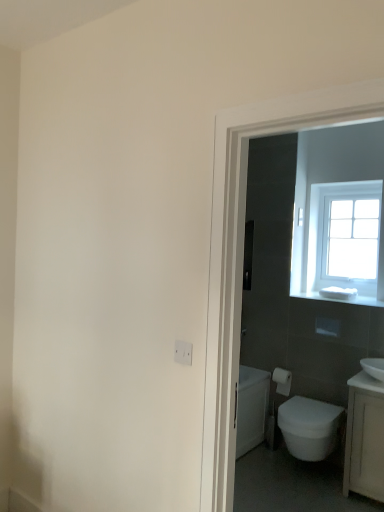
This screenshot has width=384, height=512. What do you see at coordinates (369, 375) in the screenshot?
I see `white glossy sink at right` at bounding box center [369, 375].

Describe the element at coordinates (282, 381) in the screenshot. The width and height of the screenshot is (384, 512). I see `white matte toilet paper at right` at that location.

Describe the element at coordinates (364, 437) in the screenshot. I see `white glossy sink at right` at that location.

Image resolution: width=384 pixels, height=512 pixels. In order to click on clear glass window at upper right in this screenshot , I will do `click(344, 237)`.

Where is `white plastic electric outlet at lower center`? The width and height of the screenshot is (384, 512). white plastic electric outlet at lower center is located at coordinates (183, 352).

Considering the relative positions of clear glass window at upper right and white glossy sink at right in the image provided, is clear glass window at upper right to the left or to the right of white glossy sink at right?

clear glass window at upper right is positioned on white glossy sink at right's right side.

Is the depth of clear glass window at upper right greater than that of white glossy sink at right?

Yes, clear glass window at upper right is further from the viewer.

From the image's perspective, does clear glass window at upper right appear lower than white glossy sink at right?

No, from the image's perspective, clear glass window at upper right is not below white glossy sink at right.

Between clear glass window at upper right and white glossy sink at right, which one has less height?

With less height is white glossy sink at right.

What's the angular difference between clear glass window at upper right and white glossy bidet at lower right's facing directions?

1.88 degrees separate the facing orientations of clear glass window at upper right and white glossy bidet at lower right.

From a real-world perspective, which is physically below, clear glass window at upper right or white glossy bidet at lower right?

From a 3D spatial view, white glossy bidet at lower right is below.

Does clear glass window at upper right have a greater height compared to white glossy bidet at lower right?

Yes, clear glass window at upper right is taller than white glossy bidet at lower right.

Considering the sizes of clear glass window at upper right and white glossy bidet at lower right in the image, is clear glass window at upper right wider or thinner than white glossy bidet at lower right?

clear glass window at upper right is thinner than white glossy bidet at lower right.

From a real-world perspective, which is physically above, white glossy sink at right or white glossy sink at right?

white glossy sink at right.

Does white glossy sink at right appear on the left side of white glossy sink at right?

No, white glossy sink at right is not to the left of white glossy sink at right.

Does white glossy sink at right have a smaller size compared to white glossy sink at right?

Yes.

Considering the points (374, 378) and (349, 412), which point is behind, point (374, 378) or point (349, 412)?

The point (349, 412) is behind.

Consider the image. From their relative heights in the image, would you say white plastic electric outlet at lower center is taller or shorter than clear glass window at upper right?

Clearly, white plastic electric outlet at lower center is shorter compared to clear glass window at upper right.

From the picture: Between white plastic electric outlet at lower center and clear glass window at upper right, which one appears on the right side from the viewer's perspective?

From the viewer's perspective, clear glass window at upper right appears more on the right side.

From a real-world perspective, does white plastic electric outlet at lower center sit lower than white matte toilet paper at right?

No, from a real-world perspective, white plastic electric outlet at lower center is not below white matte toilet paper at right.

Does point (180, 358) appear closer or farther from the camera than point (281, 379)?

Point (180, 358) is positioned closer to the camera compared to point (281, 379).

Is white plastic electric outlet at lower center far from white matte toilet paper at right?

white plastic electric outlet at lower center is positioned a significant distance from white matte toilet paper at right.

How many degrees apart are the facing directions of white glossy bidet at lower right and white glossy sink at right?

1.68 degrees.

Is white glossy bidet at lower right closer to the viewer compared to white glossy sink at right?

No, it is behind white glossy sink at right.

From a real-world perspective, is white glossy bidet at lower right positioned over white glossy sink at right based on gravity?

Incorrect, from a real-world perspective, white glossy bidet at lower right is lower than white glossy sink at right.

Is white glossy bidet at lower right looking in the opposite direction of white glossy sink at right?

That's not correct — white glossy bidet at lower right is not looking away from white glossy sink at right.

In terms of height, does white matte toilet paper at right look taller or shorter compared to white glossy sink at right?

Clearly, white matte toilet paper at right is shorter compared to white glossy sink at right.

Considering the sizes of objects white matte toilet paper at right and white glossy sink at right in the image provided, who is thinner, white matte toilet paper at right or white glossy sink at right?

With smaller width is white matte toilet paper at right.

Is the depth of white matte toilet paper at right greater than that of white glossy sink at right?

Yes, white matte toilet paper at right is behind white glossy sink at right.

Locate an element on the screen. The image size is (384, 512). window above the white glossy sink at right (from the image's perspective) is located at coordinates (344, 237).

Identify the location of window that appears behind the white glossy bidet at lower right. The width and height of the screenshot is (384, 512). (344, 237).

Looking at the image, which one is located further to white glossy bidet at lower right, white matte toilet paper at right or white glossy sink at right?

Among the two, white matte toilet paper at right is located further to white glossy bidet at lower right.

Estimate the real-world distances between objects in this image. Which object is closer to white glossy bidet at lower right, white glossy sink at right or clear glass window at upper right?

Based on the image, white glossy sink at right appears to be nearer to white glossy bidet at lower right.

When comparing their distances from white glossy sink at right, does white glossy bidet at lower right or clear glass window at upper right seem closer?

white glossy bidet at lower right.

In the scene shown: Based on their spatial positions, is white plastic electric outlet at lower center or clear glass window at upper right further from white glossy sink at right?

white plastic electric outlet at lower center is positioned further to the anchor white glossy sink at right.

From the image, which object appears to be nearer to white matte toilet paper at right, white glossy bidet at lower right or white glossy sink at right?

Based on the image, white glossy bidet at lower right appears to be nearer to white matte toilet paper at right.

From the picture: From the image, which object appears to be nearer to white plastic electric outlet at lower center, white glossy bidet at lower right or white glossy sink at right?

white glossy sink at right is positioned closer to the anchor white plastic electric outlet at lower center.

Which object lies further to the anchor point clear glass window at upper right, white matte toilet paper at right or white glossy sink at right?

white matte toilet paper at right.

Looking at the image, which one is located further to white glossy sink at right, white plastic electric outlet at lower center or white matte toilet paper at right?

Among the two, white plastic electric outlet at lower center is located further to white glossy sink at right.

At what (x,y) coordinates should I click in order to perform the action: click on toilet paper that lies between clear glass window at upper right and white glossy bidet at lower right from top to bottom. Please return your answer as a coordinate pair (x, y). Image resolution: width=384 pixels, height=512 pixels. Looking at the image, I should click on (282, 381).

At what (x,y) coordinates should I click in order to perform the action: click on sink between clear glass window at upper right and white glossy sink at right in the up-down direction. Please return your answer as a coordinate pair (x, y). Looking at the image, I should click on (369, 375).

Image resolution: width=384 pixels, height=512 pixels. Find the location of `toilet paper between clear glass window at upper right and white glossy sink at right in the vertical direction`. toilet paper between clear glass window at upper right and white glossy sink at right in the vertical direction is located at coordinates (282, 381).

Identify the location of sink between white plastic electric outlet at lower center and clear glass window at upper right in the front-back direction. (369, 375).